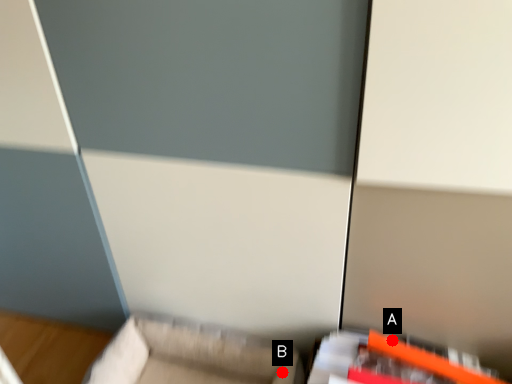
Question: Two points are circled on the image, labeled by A and B beside each circle. Which of the following is the farthest from the observer?

Choices:
 (A) A is further
 (B) B is further

Answer: (B)